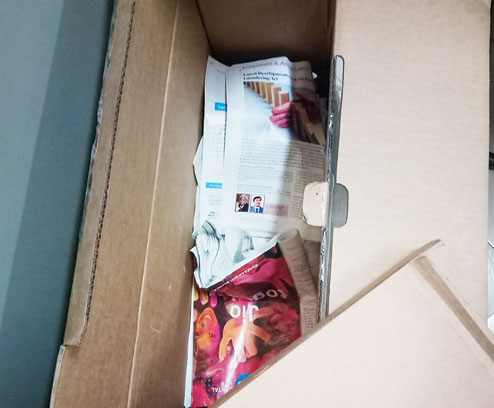
Locate an element on the screen. The width and height of the screenshot is (494, 408). pink magazine sheet is located at coordinates (212, 362).